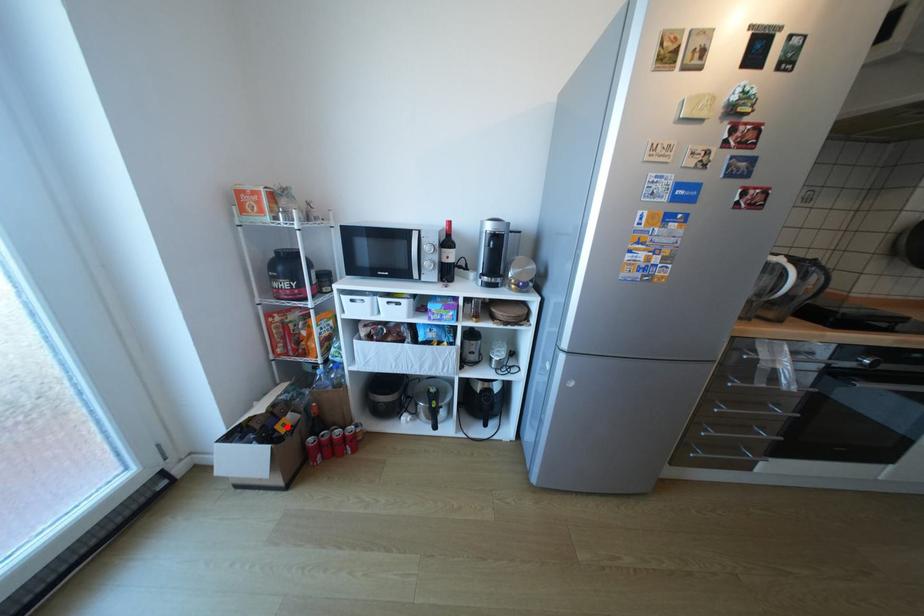
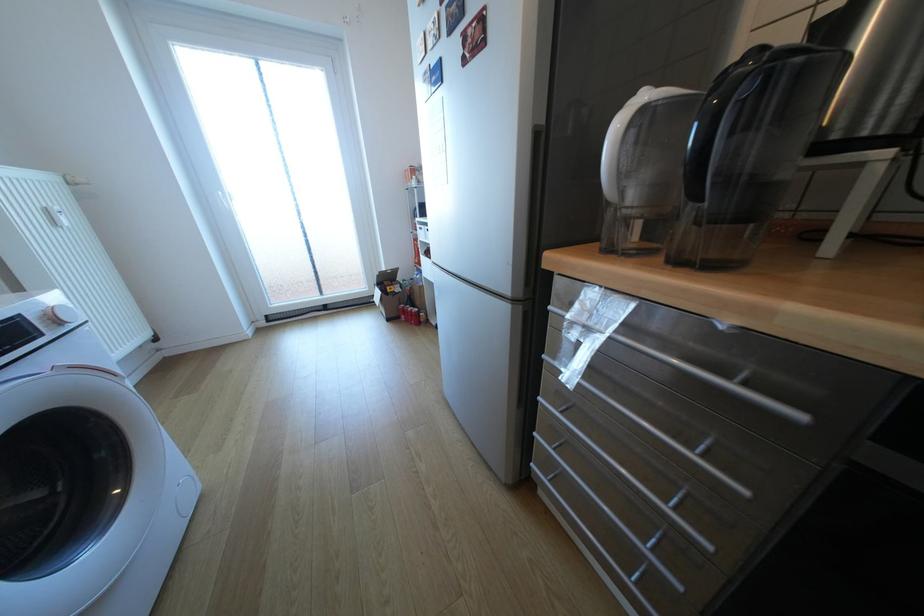
Where in the second image is the point corresponding to the highlighted location from the first image?

(397, 288)